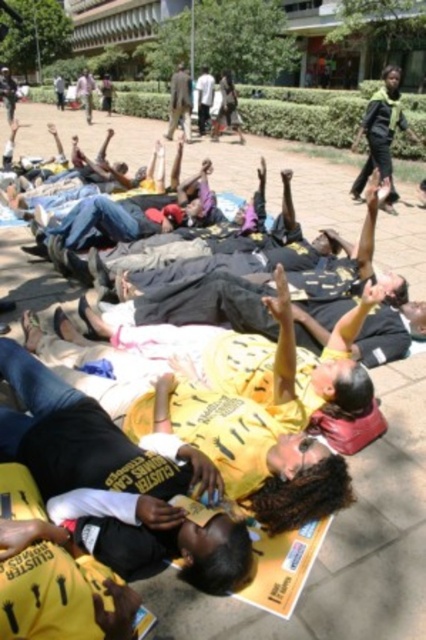
Question: Which of the following is the farthest from the observer?

Choices:
 (A) green fabric scarf at upper right
 (B) dark brown suit at center

Answer: (B)

Question: Can you confirm if green fabric scarf at upper right is wider than dark brown suit at center?

Choices:
 (A) no
 (B) yes

Answer: (B)

Question: Does green fabric scarf at upper right have a greater width compared to dark brown suit at center?

Choices:
 (A) yes
 (B) no

Answer: (A)

Question: Is green fabric scarf at upper right to the left of dark brown suit at center from the viewer's perspective?

Choices:
 (A) yes
 (B) no

Answer: (B)

Question: Which object appears closest to the camera in this image?

Choices:
 (A) green fabric scarf at upper right
 (B) dark brown suit at center

Answer: (A)